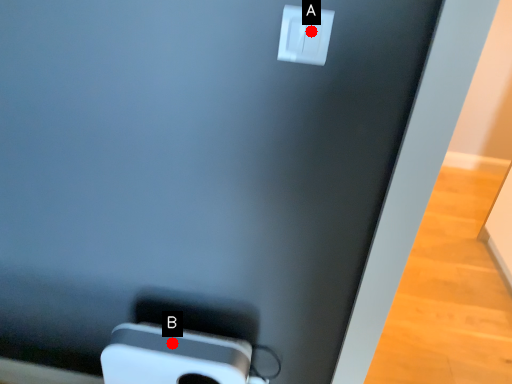
Question: Two points are circled on the image, labeled by A and B beside each circle. Among these points, which one is nearest to the camera?

Choices:
 (A) A is closer
 (B) B is closer

Answer: (A)